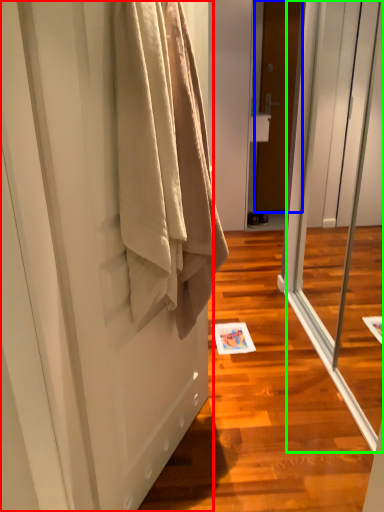
Question: Estimate the real-world distances between objects in this image. Which object is closer to door (highlighted by a red box), door (highlighted by a blue box) or screen door (highlighted by a green box)?

Choices:
 (A) door
 (B) screen door

Answer: (B)